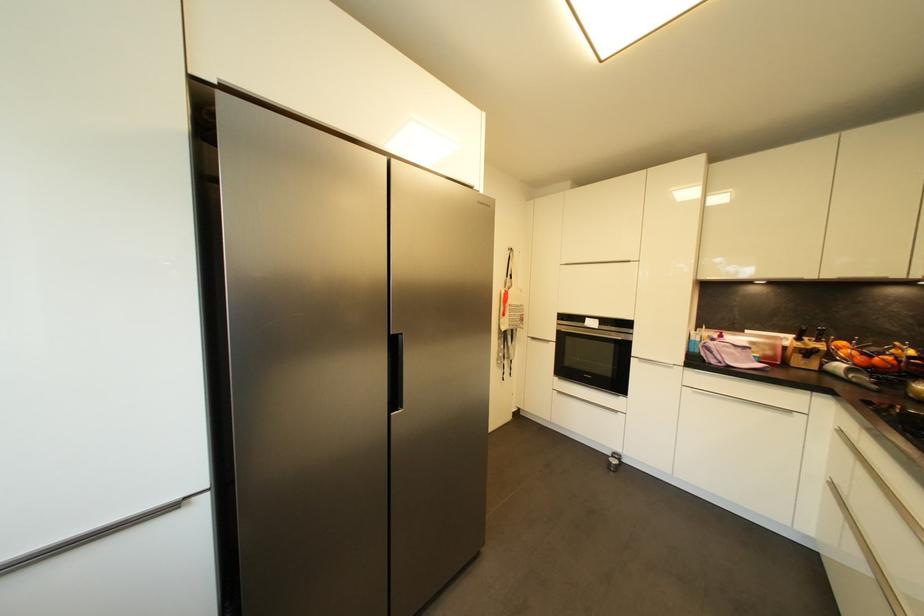
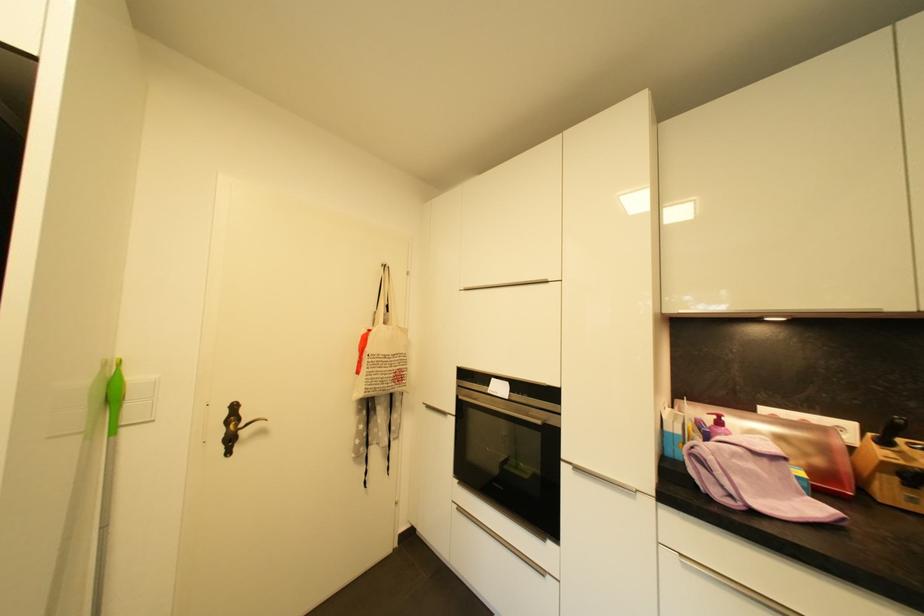
The point at (x=527, y=321) is marked in the first image. Where is the corresponding point in the second image?

(405, 379)